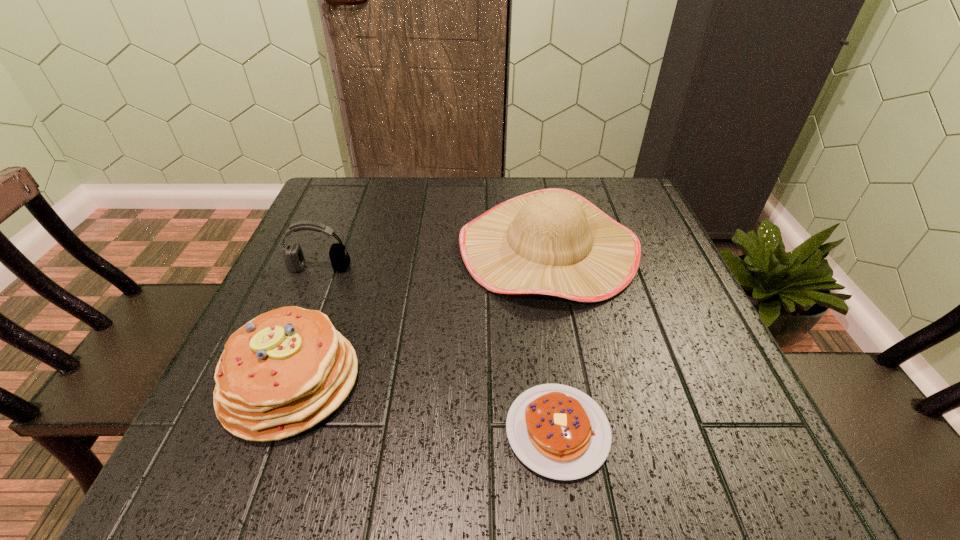
You are a GUI agent. You are given a task and a screenshot of the screen. Output one action in this format:
    pyautogui.click(x=<x>, y=<y>)
    Task: Click on the free spot that satisfies the following two spatial constraints: 1. on the headband of the left pancake; 2. on the right side of the headset
    
    Given the screenshot: What is the action you would take?
    pyautogui.click(x=274, y=382)

This screenshot has height=540, width=960. Identify the location of free space that satisfies the following two spatial constraints: 1. on the back side of the sunhat; 2. on the left side of the shortest object. (532, 247).